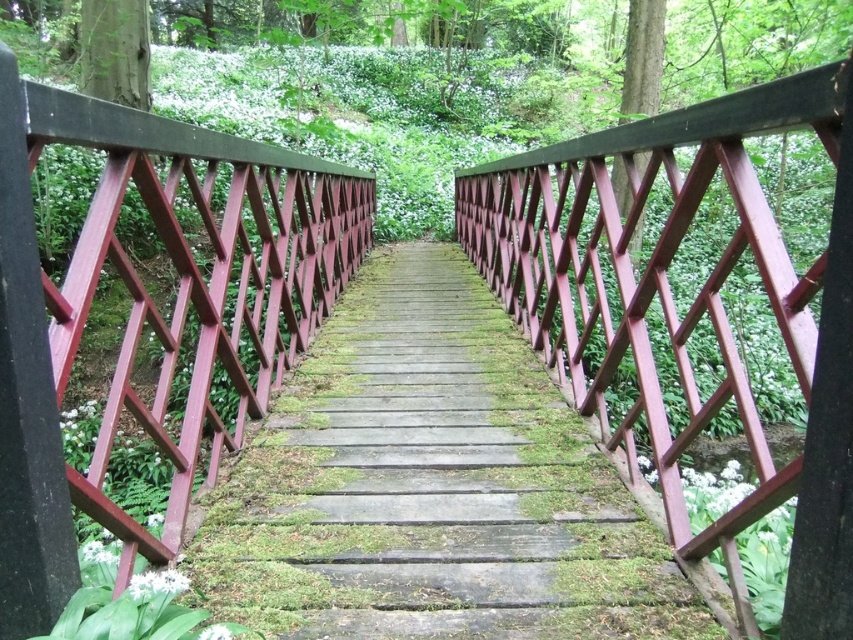
Consider the image. You are standing on the wooden bridge and want to grab the matte red wooden rail at upper center. Which direction should you move to reach it from the smooth red wooden balustrade at center?

You should move to the right to reach the matte red wooden rail at upper center from the smooth red wooden balustrade at center because the matte red wooden rail at upper center is located to the right of the smooth red wooden balustrade at center.

You are a hiker who just arrived at the wooden bridge. You need to cross it but want to ensure your safety. Which object, the wooden stairs at center or the smooth red wooden balustrade at center, is taller and can provide better support?

The smooth red wooden balustrade at center is taller than the wooden stairs at center, so it can provide better support.